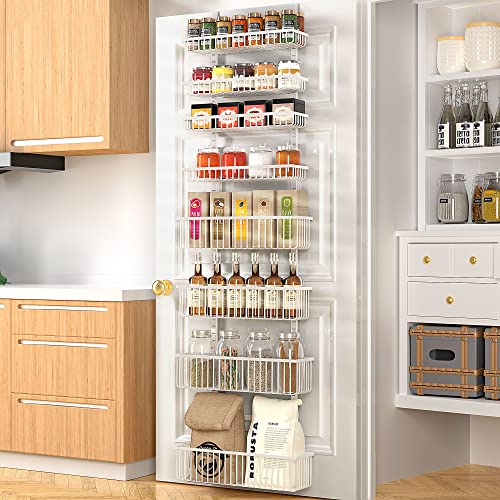
You are a GUI agent. You are given a task and a screenshot of the screen. Output one action in this format:
    pyautogui.click(x=<x>, y=<y>)
    Task: Click on the glass jars on second from lower shelf
    Image resolution: width=500 pixels, height=500 pixels.
    Given the screenshot: What is the action you would take?
    pyautogui.click(x=200, y=346), pyautogui.click(x=227, y=347), pyautogui.click(x=257, y=348), pyautogui.click(x=289, y=348)